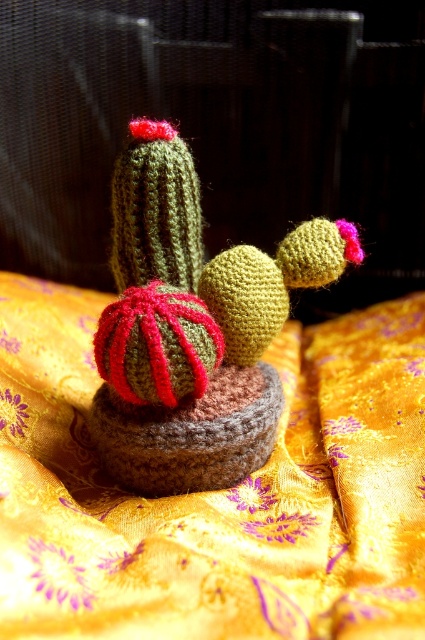
Question: Observing the image, what is the correct spatial positioning of yellow satin blanket at center in reference to knitted green cactus at center?

Choices:
 (A) below
 (B) above

Answer: (A)

Question: Can you confirm if yellow satin blanket at center is positioned below knitted green cactus at center?

Choices:
 (A) yes
 (B) no

Answer: (A)

Question: Does yellow satin blanket at center come behind knitted green cactus at center?

Choices:
 (A) no
 (B) yes

Answer: (A)

Question: Which point appears closest to the camera in this image?

Choices:
 (A) click(189, 173)
 (B) click(61, 413)

Answer: (A)